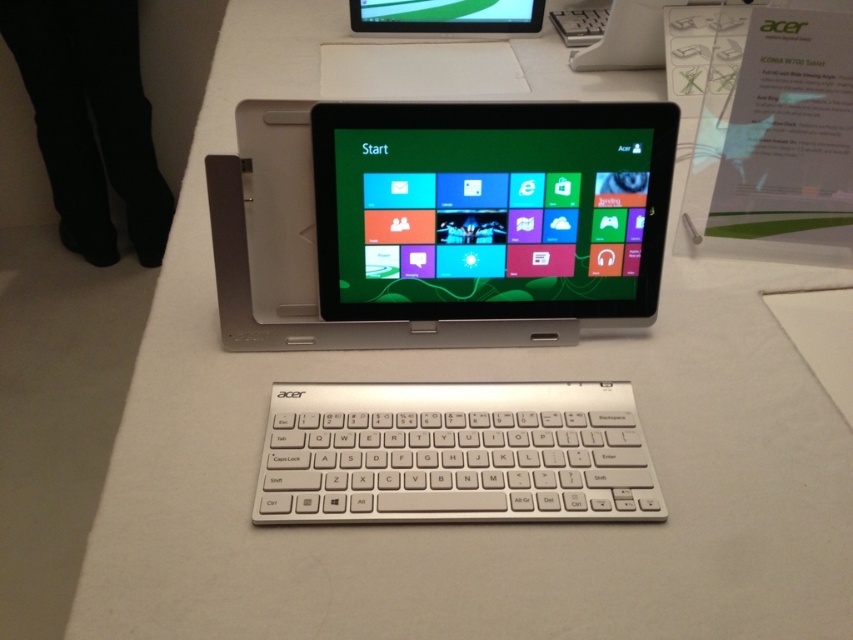
You are setting up a presentation and need to place a wireless mouse next to the matte plastic tablet at center. According to the coordinate system where the bottom left corner is the origin, where should you place the mouse to ensure it is 5 cm to the right and 3 cm above the tablet?

To place the wireless mouse 5 cm to the right and 3 cm above the matte plastic tablet at center, you should position it at coordinates approximately at point 0.342 plus 0.05 and 0.574 plus 0.03. However, the exact coordinates depend on the scale of the coordinate system used in the image.

You are setting up a presentation and need to place both the silver metallic tablet at center and the white matte keyboard at center on a small desk. Given their sizes, which object should you place first to ensure both fit properly?

The silver metallic tablet at center is larger in size than the white matte keyboard at center, so you should place the silver metallic tablet at center first to ensure there is enough space left for the white matte keyboard at center.